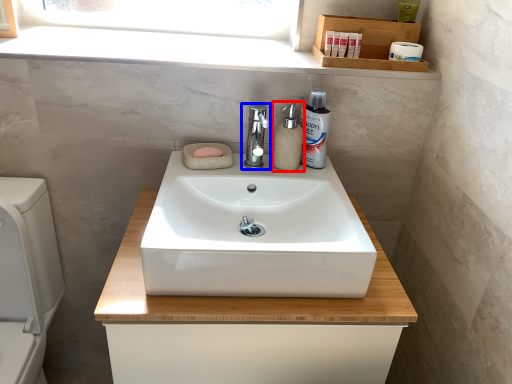
Question: Which object appears closest to the camera in this image, soap dispenser (highlighted by a red box) or tap (highlighted by a blue box)?

Choices:
 (A) soap dispenser
 (B) tap

Answer: (B)